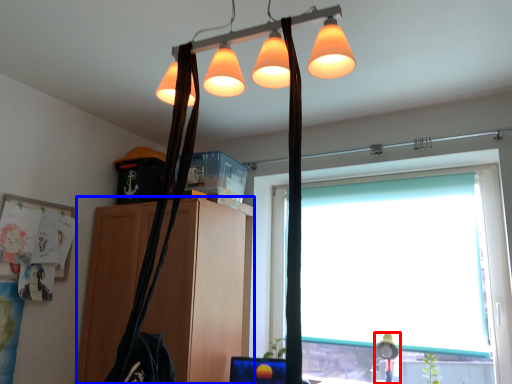
Question: Which of the following is the farthest to the observer, table lamp (highlighted by a red box) or cabinetry (highlighted by a blue box)?

Choices:
 (A) table lamp
 (B) cabinetry

Answer: (A)